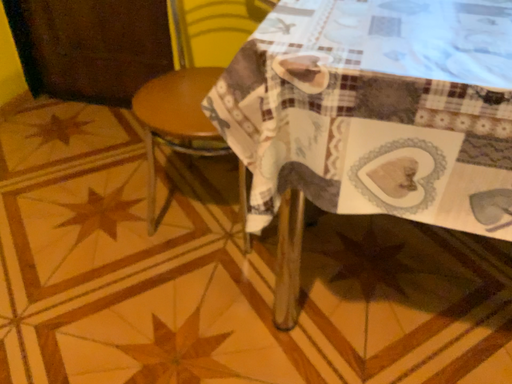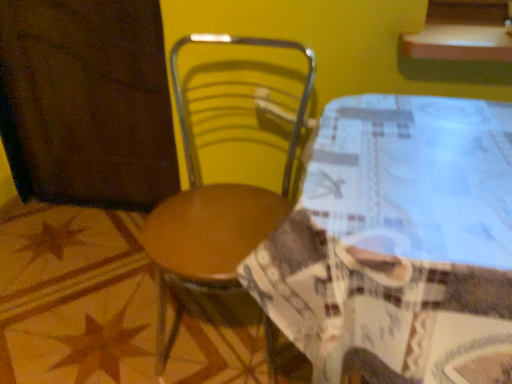
Question: Which way did the camera rotate in the video?

Choices:
 (A) rotated upward
 (B) rotated downward

Answer: (A)